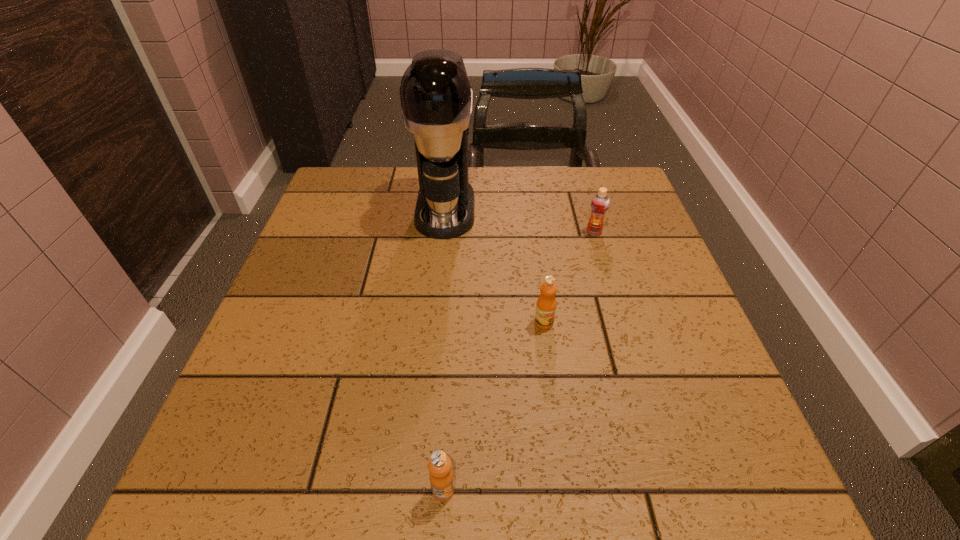
Locate which orange juice is the closest to the third object from left to right. Please provide its 2D coordinates. Your answer should be formatted as a tuple, i.e. [(x, y)], where the tuple contains the x and y coordinates of a point satisfying the conditions above.

[(600, 202)]

Identify which orange juice is the second nearest to the nearest object. Please provide its 2D coordinates. Your answer should be formatted as a tuple, i.e. [(x, y)], where the tuple contains the x and y coordinates of a point satisfying the conditions above.

[(600, 202)]

This screenshot has height=540, width=960. I want to click on blank space that satisfies the following two spatial constraints: 1. place cup under the spout of the rightmost object; 2. on the left side of the coffee maker, so click(444, 232).

You are a GUI agent. You are given a task and a screenshot of the screen. Output one action in this format:
    pyautogui.click(x=<x>, y=<y>)
    Task: Click on the vacant space that satisfies the following two spatial constraints: 1. place cup under the spout of the rightmost orange juice; 2. on the left side of the coffee maker
    This screenshot has width=960, height=540.
    Given the screenshot: What is the action you would take?
    pyautogui.click(x=444, y=232)

At what (x,y) coordinates should I click in order to perform the action: click on vacant area that satisfies the following two spatial constraints: 1. place cup under the spout of the tallest object; 2. on the left side of the rightmost orange juice. Please return your answer as a coordinate pair (x, y). Looking at the image, I should click on (444, 232).